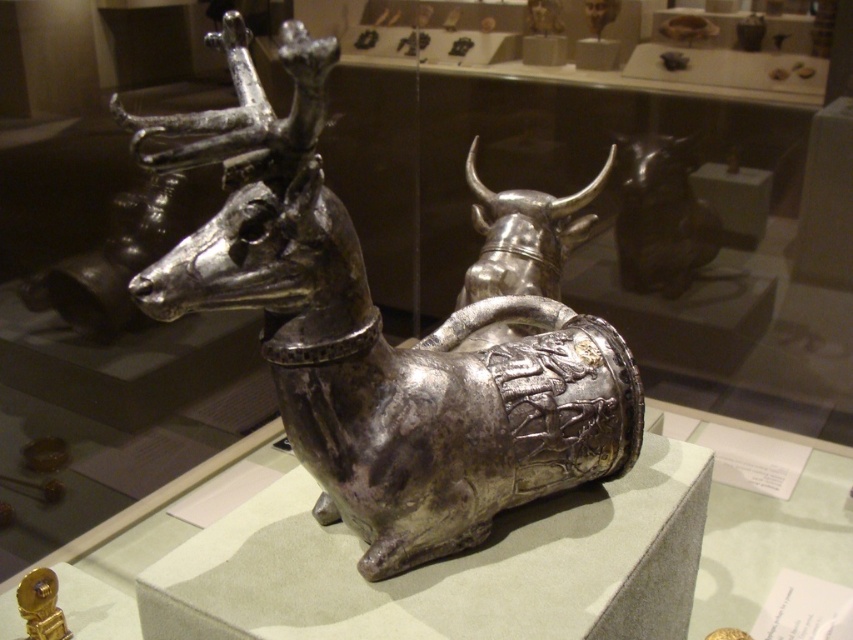
Is polished silver bull at center wider than shiny black statue at upper right?

Correct, the width of polished silver bull at center exceeds that of shiny black statue at upper right.

Between polished silver bull at center and shiny black statue at upper right, which one is positioned higher?

Positioned higher is shiny black statue at upper right.

Who is more distant from viewer, (549, 253) or (688, 170)?

The point (688, 170) is more distant.

The width and height of the screenshot is (853, 640). Identify the location of polished silver bull at center. (524, 236).

Is the position of shiny silver deer at center less distant than that of shiny black statue at upper right?

Yes, it is.

Is shiny silver deer at center to the left of shiny black statue at upper right from the viewer's perspective?

Correct, you'll find shiny silver deer at center to the left of shiny black statue at upper right.

Identify the location of shiny silver deer at center. point(379,339).

Can you confirm if shiny silver deer at center is wider than polished silver bull at center?

Indeed, shiny silver deer at center has a greater width compared to polished silver bull at center.

Can you confirm if shiny silver deer at center is positioned above polished silver bull at center?

Actually, shiny silver deer at center is below polished silver bull at center.

This screenshot has width=853, height=640. What are the coordinates of `shiny silver deer at center` in the screenshot? It's located at (379, 339).